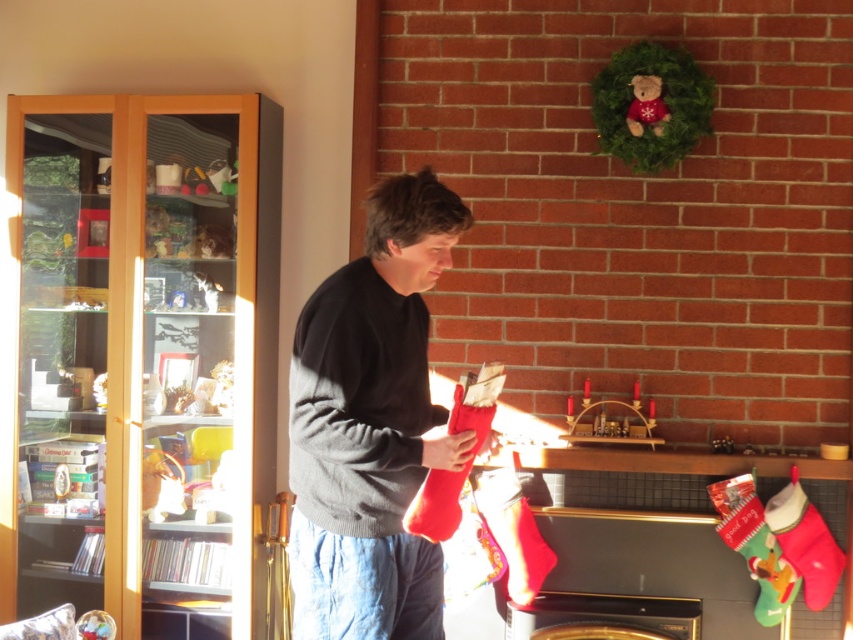
Is wooden bookshelf at left wider than dark gray sweater at center?

Correct, the width of wooden bookshelf at left exceeds that of dark gray sweater at center.

Which is in front, point (67, 314) or point (403, 284)?

Point (403, 284) is more forward.

Who is more forward, (15, 392) or (363, 300)?

Point (363, 300) is more forward.

Locate an element on the screen. wooden bookshelf at left is located at coordinates (144, 362).